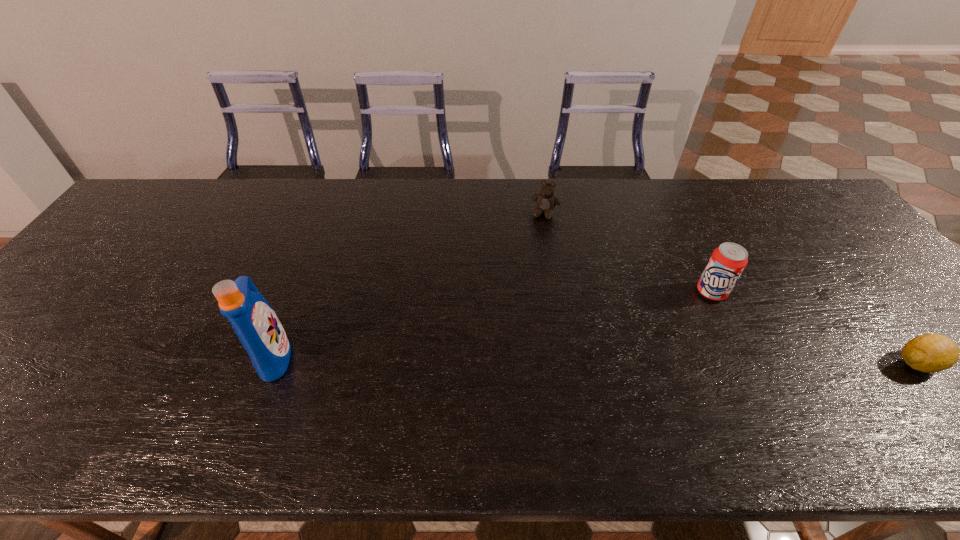
Identify the location of the tallest object. The image size is (960, 540). click(257, 326).

You are a GUI agent. You are given a task and a screenshot of the screen. Output one action in this format:
    pyautogui.click(x=<x>, y=<y>)
    Task: Click on the leftmost object
    Image resolution: width=960 pixels, height=540 pixels.
    Given the screenshot: What is the action you would take?
    pyautogui.click(x=257, y=326)

I want to click on the rightmost object, so click(x=930, y=353).

You are a GUI agent. You are given a task and a screenshot of the screen. Output one action in this format:
    pyautogui.click(x=<x>, y=<y>)
    Task: Click on the shortest object
    Image resolution: width=960 pixels, height=540 pixels.
    Given the screenshot: What is the action you would take?
    pyautogui.click(x=930, y=353)

Locate an element on the screen. Image resolution: width=960 pixels, height=540 pixels. teddy bear is located at coordinates (x=546, y=201).

I want to click on the farthest object, so click(546, 201).

Locate an element on the screen. the second tallest object is located at coordinates (727, 262).

You are a GUI agent. You are given a task and a screenshot of the screen. Output one action in this format:
    pyautogui.click(x=<x>, y=<y>)
    Task: Click on the third object from left to right
    This screenshot has height=540, width=960.
    Given the screenshot: What is the action you would take?
    pyautogui.click(x=727, y=262)

This screenshot has height=540, width=960. I want to click on free space located 0.230m on the label of the tallest object, so click(x=392, y=355).

Find the location of `vacant position located 0.320m on the face of the teddy bear`. vacant position located 0.320m on the face of the teddy bear is located at coordinates point(520,296).